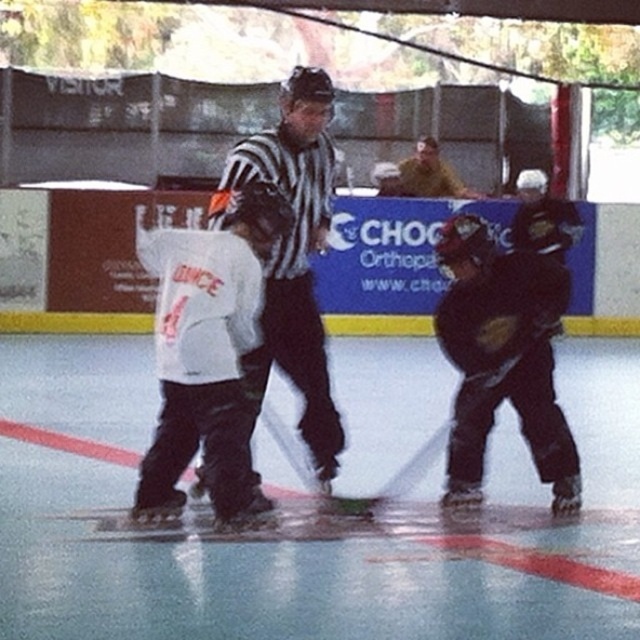
You are a spectator at the game and want to take a photo of the black striped shirt at center and the black matte hockey stick at center. Which object should you focus on first to ensure both are in the frame?

The black striped shirt at center is positioned over the black matte hockey stick at center, so you should focus on the black striped shirt at center first to ensure both are in the frame.

You are a spectator at the game and want to take a photo of the black striped shirt at center and the black matte hockey helmet at center. Which object should you focus on first to ensure both are in frame?

The black striped shirt at center is behind the black matte hockey helmet at center, so you should focus on the black matte hockey helmet at center first to ensure both are in frame.

You are a spectator at the ice hockey game. You notice the white jersey at center and the black matte hockey stick at center. Which object is positioned more to the left?

The white jersey at center is positioned to the left of the black matte hockey stick at center, so the white jersey at center is more to the left.